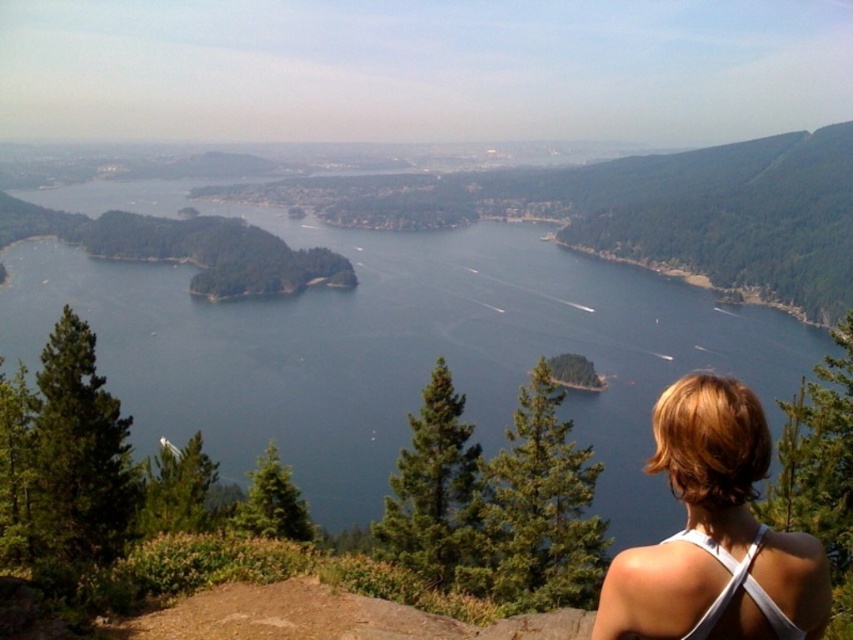
Is point (587, 296) closer to camera compared to point (820, 634)?

No, (587, 296) is behind (820, 634).

Who is positioned more to the left, blue water at center or white fabric at center?

blue water at center is more to the left.

This screenshot has height=640, width=853. In order to click on blue water at center in this screenshot , I will do `click(392, 348)`.

What are the coordinates of `blue water at center` in the screenshot? It's located at (392, 348).